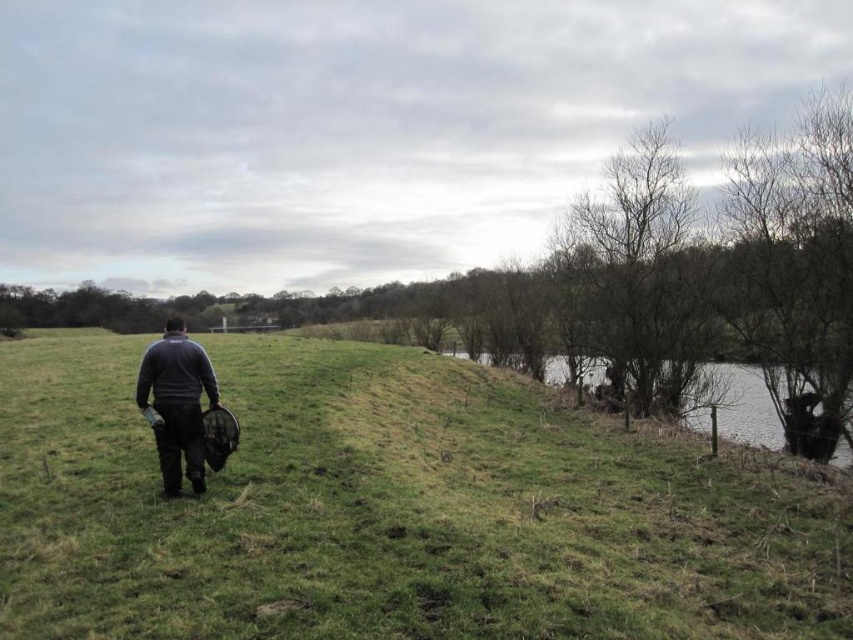
Question: Which of the following is the closest to the observer?

Choices:
 (A) (107, 541)
 (B) (762, 388)
 (C) (699, 308)

Answer: (A)

Question: Which point appears closest to the camera in this image?

Choices:
 (A) (165, 426)
 (B) (45, 541)

Answer: (B)

Question: Is green grassy hill at center below bare branches at upper right?

Choices:
 (A) yes
 (B) no

Answer: (A)

Question: Can you confirm if dark gray fabric jacket at center is positioned below green grassy bank at right?

Choices:
 (A) yes
 (B) no

Answer: (B)

Question: Which point appears closest to the camera in this image?

Choices:
 (A) (677, 360)
 (B) (526, 538)
 (C) (161, 371)

Answer: (B)

Question: Does dark gray fabric jacket at center have a smaller size compared to green grassy bank at right?

Choices:
 (A) no
 (B) yes

Answer: (B)